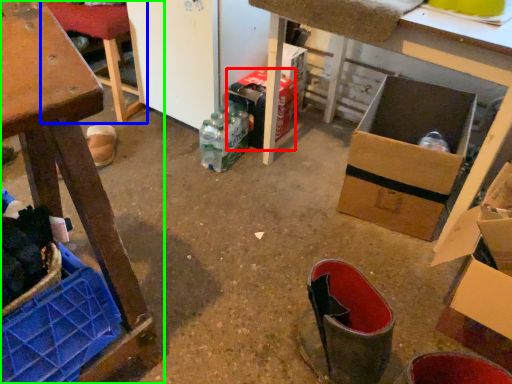
Question: Based on their relative distances, which object is nearer to cardboard box (highlighted by a red box)? Choose from furniture (highlighted by a blue box) and furniture (highlighted by a green box).

Choices:
 (A) furniture
 (B) furniture

Answer: (A)